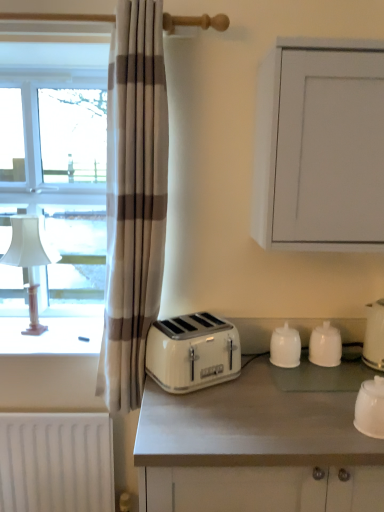
Image resolution: width=384 pixels, height=512 pixels. What do you see at coordinates (192, 352) in the screenshot? I see `white plastic toaster at center` at bounding box center [192, 352].

The image size is (384, 512). What do you see at coordinates (51, 336) in the screenshot?
I see `white plastic window sill at left` at bounding box center [51, 336].

Locate an element on the screen. white glossy table lamp at left is located at coordinates (30, 259).

Describe the element at coordinates (56, 462) in the screenshot. The width and height of the screenshot is (384, 512). I see `white matte radiator at lower left` at that location.

Measure the distance between point (194, 456) and camera.

The depth of point (194, 456) is 3.65 feet.

What do you see at coordinates (259, 443) in the screenshot? I see `white matte countertop at center` at bounding box center [259, 443].

Where is `white glossy salt shaker at center, the 4th kitchen appliance positioned from the right`? This screenshot has height=512, width=384. white glossy salt shaker at center, the 4th kitchen appliance positioned from the right is located at coordinates (285, 347).

Consider the image. Does white matte countertop at center turn towards white glossy table lamp at left?

No, white matte countertop at center is not aimed at white glossy table lamp at left.

Where is `table lamp behind the white matte countertop at center`? This screenshot has height=512, width=384. table lamp behind the white matte countertop at center is located at coordinates (30, 259).

Consider the image. From a real-world perspective, is white matte countertop at center above or below white glossy table lamp at left?

Clearly, from a real-world perspective, white matte countertop at center is below white glossy table lamp at left.

Does white plastic toaster at center have a larger size compared to white glossy table lamp at left?

Incorrect, white plastic toaster at center is not larger than white glossy table lamp at left.

Locate an element on the screen. This screenshot has height=512, width=384. toaster below the white glossy table lamp at left (from the image's perspective) is located at coordinates (192, 352).

From a real-world perspective, which is physically above, white plastic toaster at center or white glossy table lamp at left?

white glossy table lamp at left, from a real-world perspective.

Is white plastic toaster at center facing towards white glossy table lamp at left?

No, white plastic toaster at center is not aimed at white glossy table lamp at left.

Could you tell me if white glossy table lamp at left is facing white plastic window sill at left?

No, white glossy table lamp at left is not facing towards white plastic window sill at left.

In the scene shown: How far apart are white glossy table lamp at left and white plastic window sill at left?

white glossy table lamp at left and white plastic window sill at left are 19.85 centimeters apart.

Can you confirm if white glossy table lamp at left is wider than white plastic window sill at left?

No.

Can you see white glossy table lamp at left touching white plastic window sill at left?

No, white glossy table lamp at left is not with white plastic window sill at left.

Is white matte radiator at lower left not close to white glossy cup at lower right, which ranks as the 2th kitchen appliance in right-to-left order?

Yes, white matte radiator at lower left and white glossy cup at lower right, which ranks as the 2th kitchen appliance in right-to-left order, are quite far apart.

Considering the sizes of objects white matte radiator at lower left and white glossy cup at lower right, which appears as the third kitchen appliance when viewed from the left, in the image provided, who is taller, white matte radiator at lower left or white glossy cup at lower right, which appears as the third kitchen appliance when viewed from the left,?

white matte radiator at lower left.

From the image's perspective, is white matte radiator at lower left above white glossy cup at lower right, the 4th kitchen appliance in the back-to-front sequence?

Incorrect, from the image's perspective, white matte radiator at lower left is lower than white glossy cup at lower right, the 4th kitchen appliance in the back-to-front sequence.

Which is correct: white matte countertop at center is inside white glossy cup at lower right, the 4th kitchen appliance in the back-to-front sequence, or outside of it?

white matte countertop at center lies outside white glossy cup at lower right, the 4th kitchen appliance in the back-to-front sequence.

Is white matte countertop at center taller than white glossy cup at lower right, which appears as the third kitchen appliance when viewed from the left?

Indeed, white matte countertop at center has a greater height compared to white glossy cup at lower right, which appears as the third kitchen appliance when viewed from the left.

Identify the location of countertop on the left of white glossy cup at lower right, the 4th kitchen appliance in the back-to-front sequence. [x=259, y=443].

Measure the distance between white matte countertop at center and white glossy cup at lower right, the 4th kitchen appliance in the back-to-front sequence.

white matte countertop at center and white glossy cup at lower right, the 4th kitchen appliance in the back-to-front sequence, are 11.99 inches apart.

Is white glossy cup at lower right, which is the 1th kitchen appliance from front to back, in front of white matte countertop at center?

No, white glossy cup at lower right, which is the 1th kitchen appliance from front to back, is further to the viewer.

From the image's perspective, is white glossy cup at lower right, which appears as the third kitchen appliance when viewed from the left, located above or below white matte countertop at center?

Clearly, from the image's perspective, white glossy cup at lower right, which appears as the third kitchen appliance when viewed from the left, is above white matte countertop at center.

Locate an element on the screen. The image size is (384, 512). countertop to the left of white glossy cup at lower right, which appears as the third kitchen appliance when viewed from the left is located at coordinates [x=259, y=443].

Considering the relative sizes of white glossy cup at lower right, which is the 1th kitchen appliance from front to back, and white matte countertop at center in the image provided, is white glossy cup at lower right, which is the 1th kitchen appliance from front to back, smaller than white matte countertop at center?

Yes.

Based on the photo, is there a large distance between white plastic toaster at center and white matte countertop at center?

That's not correct — white plastic toaster at center is a little close to white matte countertop at center.

Looking at this image, how different are the orientations of white plastic toaster at center and white matte countertop at center in degrees?

The angle between the facing direction of white plastic toaster at center and the facing direction of white matte countertop at center is 29.6 degrees.

Considering the relative sizes of white plastic toaster at center and white matte countertop at center in the image provided, is white plastic toaster at center taller than white matte countertop at center?

Incorrect, the height of white plastic toaster at center is not larger of that of white matte countertop at center.

From a real-world perspective, is white plastic toaster at center physically located above or below white matte countertop at center?

white plastic toaster at center is situated higher than white matte countertop at center in the real world.

You are a GUI agent. You are given a task and a screenshot of the screen. Output one action in this format:
    pyautogui.click(x=<x>, y=<y>)
    Task: Click on the countertop on the right of white glossy table lamp at left
    
    Given the screenshot: What is the action you would take?
    pyautogui.click(x=259, y=443)

Identify the location of toaster located in front of the white glossy table lamp at left. (192, 352).

Looking at this image, looking at the image, which one is located closer to white matte radiator at lower left, white glossy salt shaker at center, which is the second kitchen appliance in back-to-front order, or white glossy kettle at right, the 3th kitchen appliance in the back-to-front sequence?

white glossy salt shaker at center, which is the second kitchen appliance in back-to-front order.

Based on their spatial positions, is white glossy cups at center, which is the 1th kitchen appliance from back to front, or beige striped curtain at left further from white matte countertop at center?

The object further to white matte countertop at center is beige striped curtain at left.

From the picture: Considering their positions, is white matte radiator at lower left positioned closer to white glossy kettle at right, arranged as the first kitchen appliance when viewed from the right, than white matte countertop at center?

Among the two, white matte countertop at center is located nearer to white glossy kettle at right, arranged as the first kitchen appliance when viewed from the right.

When comparing their distances from white plastic window sill at left, does white matte radiator at lower left or white glossy cup at lower right, which is the 1th kitchen appliance from front to back, seem further?

Based on the image, white glossy cup at lower right, which is the 1th kitchen appliance from front to back, appears to be further to white plastic window sill at left.

Considering their positions, is white matte cabinet at upper right positioned closer to white plastic window sill at left than white glossy kettle at right, the 4th kitchen appliance in the left-to-right sequence?

Based on the image, white matte cabinet at upper right appears to be nearer to white plastic window sill at left.

When comparing their distances from white glossy kettle at right, the 4th kitchen appliance in the left-to-right sequence, does beige striped curtain at left or white matte cabinet at upper right seem closer?

white matte cabinet at upper right.

Which object lies further to the anchor point white matte countertop at center, white plastic toaster at center or white glossy table lamp at left?

Based on the image, white glossy table lamp at left appears to be further to white matte countertop at center.

Based on their spatial positions, is white matte radiator at lower left or white glossy cups at center, which is the 1th kitchen appliance from back to front, further from white glossy table lamp at left?

The object further to white glossy table lamp at left is white glossy cups at center, which is the 1th kitchen appliance from back to front.

Identify the location of toaster that lies between beige striped curtain at left and white matte countertop at center from top to bottom. Image resolution: width=384 pixels, height=512 pixels. (192, 352).

Locate an element on the screen. toaster that lies between white matte cabinet at upper right and white glossy cups at center, which appears as the 4th kitchen appliance when viewed from the front, from top to bottom is located at coordinates (192, 352).

At what (x,y) coordinates should I click in order to perform the action: click on radiator between white glossy table lamp at left and white matte cabinet at upper right in the horizontal direction. Please return your answer as a coordinate pair (x, y). Looking at the image, I should click on (56, 462).

Where is `toaster between white glossy table lamp at left and white matte radiator at lower left from top to bottom`? toaster between white glossy table lamp at left and white matte radiator at lower left from top to bottom is located at coordinates (192, 352).